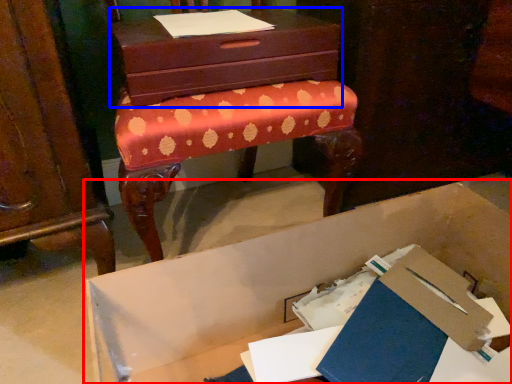
Question: Among these objects, which one is farthest to the camera, cardboard box (highlighted by a red box) or chest of drawers (highlighted by a blue box)?

Choices:
 (A) cardboard box
 (B) chest of drawers

Answer: (B)